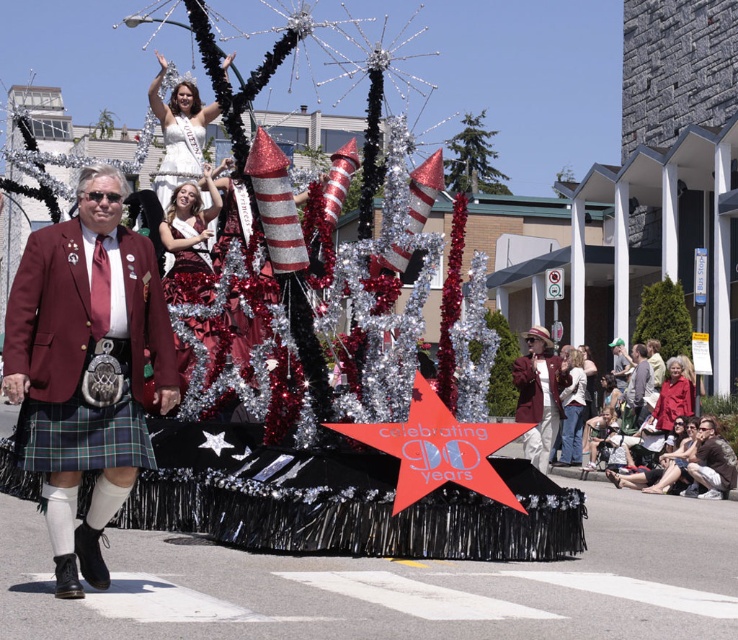
Does white satin sash at center have a greater width compared to white textured jacket at lower right?

Indeed, white satin sash at center has a greater width compared to white textured jacket at lower right.

This screenshot has width=738, height=640. Describe the element at coordinates (179, 132) in the screenshot. I see `white satin sash at center` at that location.

Identify the location of white satin sash at center. Image resolution: width=738 pixels, height=640 pixels. (179, 132).

Is point (175, 180) positioned after point (649, 358)?

No, it is in front of (649, 358).

Can you confirm if shiny silver dress at center is positioned to the right of light brown leather jacket at center?

In fact, shiny silver dress at center is to the left of light brown leather jacket at center.

Describe the element at coordinates (179, 156) in the screenshot. Image resolution: width=738 pixels, height=640 pixels. I see `shiny silver dress at center` at that location.

Locate an element on the screen. shiny silver dress at center is located at coordinates (179, 156).

Who is more distant from viewer, (58, 573) or (201, 145)?

Positioned behind is point (201, 145).

Does maroon wool jacket at center appear over shiny silver dress at center?

Actually, maroon wool jacket at center is below shiny silver dress at center.

Between point (106, 401) and point (189, 156), which one is positioned behind?

The point (189, 156) is more distant.

Identify the location of maroon wool jacket at center. (86, 368).